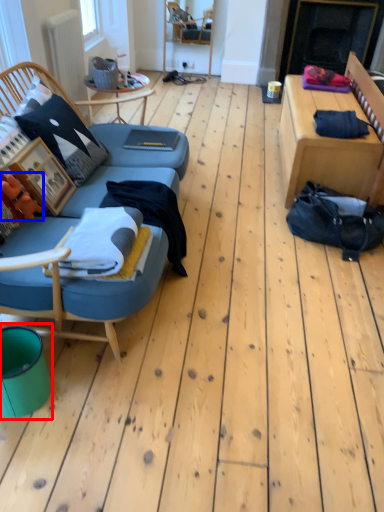
Question: Which object appears closest to the camera in this image, teal (highlighted by a red box) or toy (highlighted by a blue box)?

Choices:
 (A) teal
 (B) toy

Answer: (A)